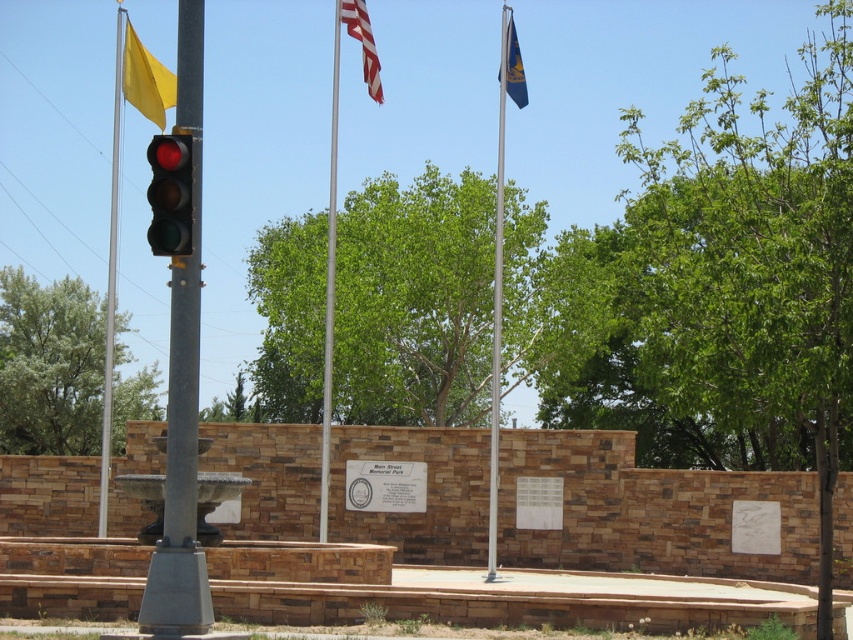
Question: Which object is closer to the camera taking this photo?

Choices:
 (A) yellow fabric flag at upper left
 (B) metallic flag pole at center

Answer: (A)

Question: From the image, what is the correct spatial relationship of yellow flag at left in relation to blue fabric flag at upper right?

Choices:
 (A) above
 (B) below

Answer: (B)

Question: Which object appears closest to the camera in this image?

Choices:
 (A) metallic flag pole at center
 (B) blue fabric flag at upper right
 (C) american flag at upper center
 (D) yellow fabric flag at upper left

Answer: (D)

Question: Is yellow flag at left below yellow fabric flag at upper left?

Choices:
 (A) yes
 (B) no

Answer: (A)

Question: Is the position of yellow flag at left more distant than that of american flag at upper center?

Choices:
 (A) yes
 (B) no

Answer: (B)

Question: Considering the real-world distances, which object is closest to the metallic flag pole at center?

Choices:
 (A) blue fabric flag at upper right
 (B) yellow flag at left

Answer: (B)